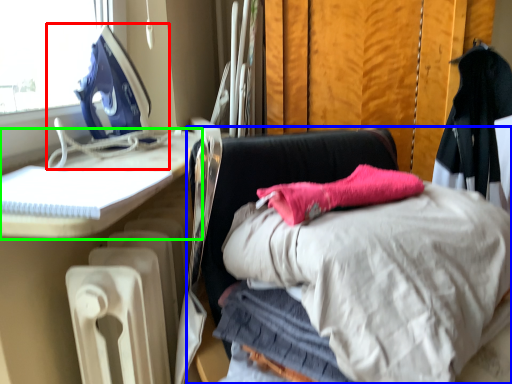
Question: Based on their relative distances, which object is farther from sewing machine (highlighted by a red box)? Choose from furniture (highlighted by a blue box) and furniture (highlighted by a green box).

Choices:
 (A) furniture
 (B) furniture

Answer: (A)